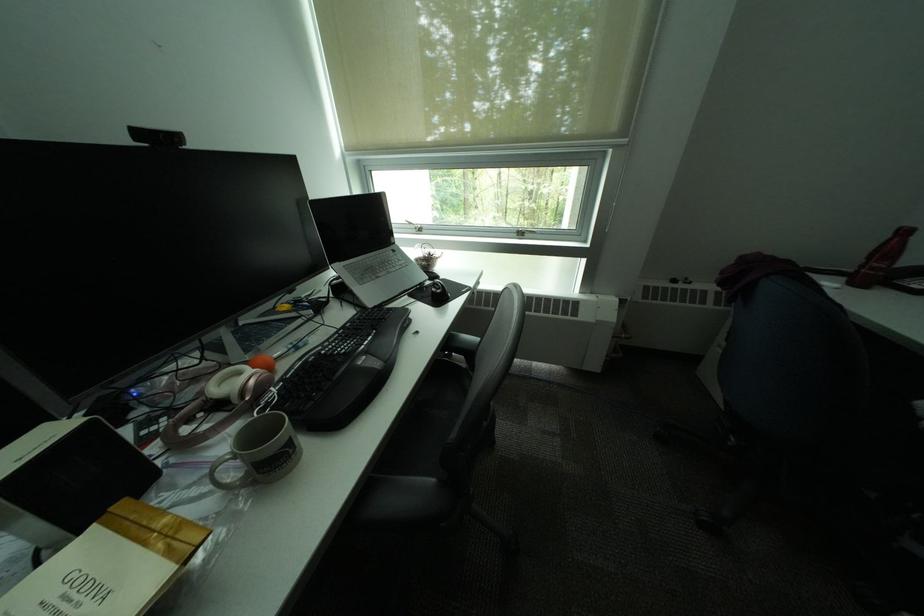
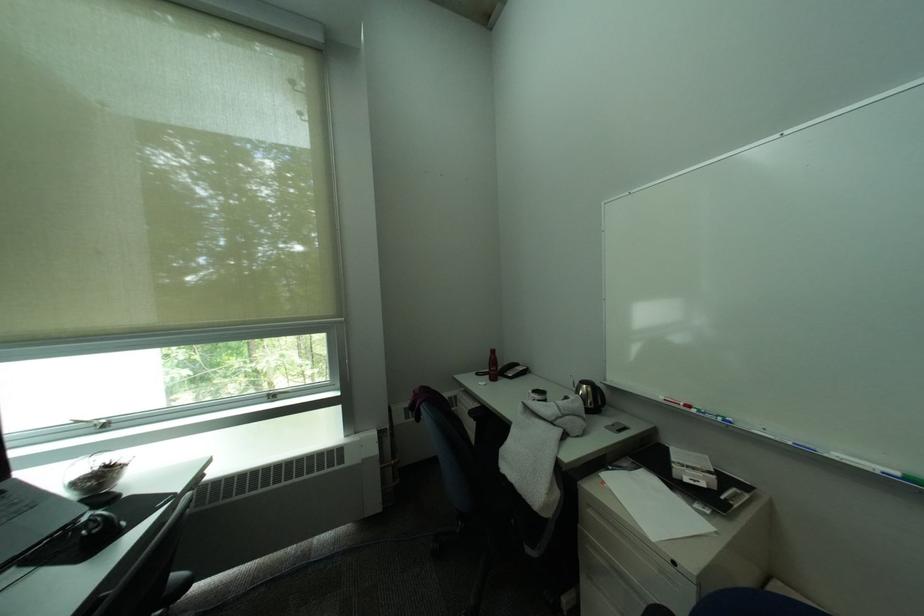
Where in the second image is the point corresponding to point (450, 290) from the first image?

(106, 528)